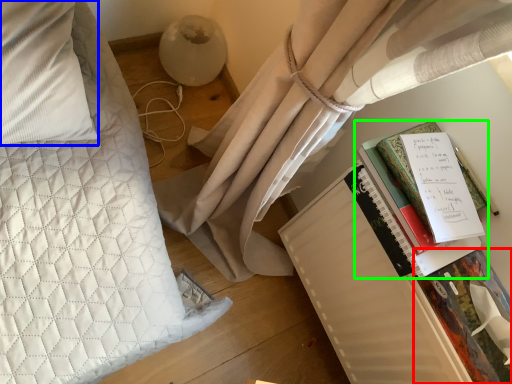
Question: Estimate the real-world distances between objects in this image. Which object is closer to paperback book (highlighted by a red box), pillow (highlighted by a blue box) or book (highlighted by a green box)?

Choices:
 (A) pillow
 (B) book

Answer: (B)